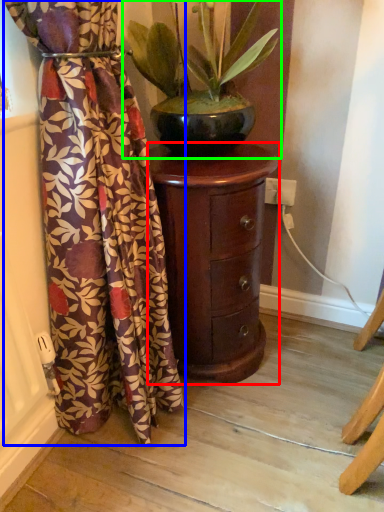
Question: Which object is positioned farthest from furniture (highlighted by a red box)? Select from curtain (highlighted by a blue box) and houseplant (highlighted by a green box).

Choices:
 (A) curtain
 (B) houseplant

Answer: (B)